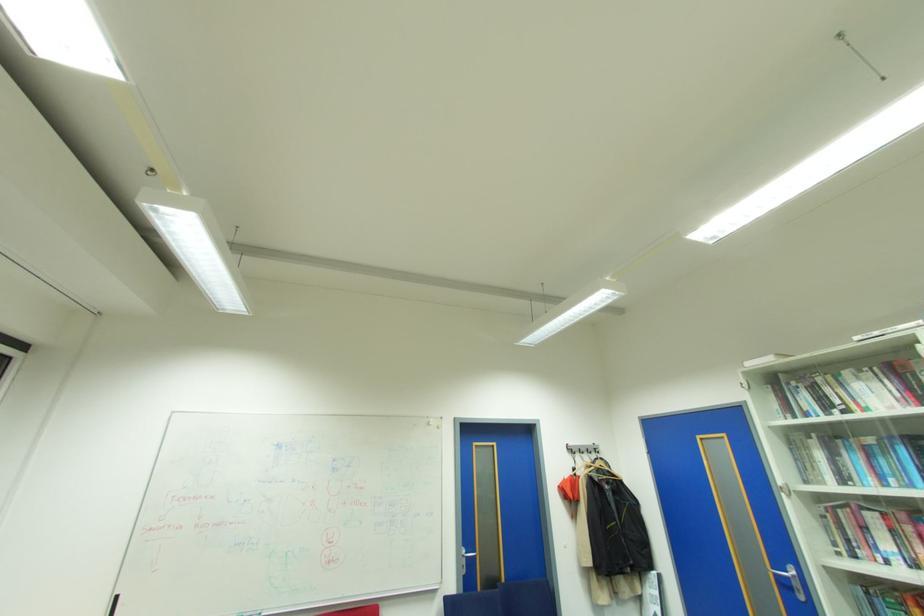
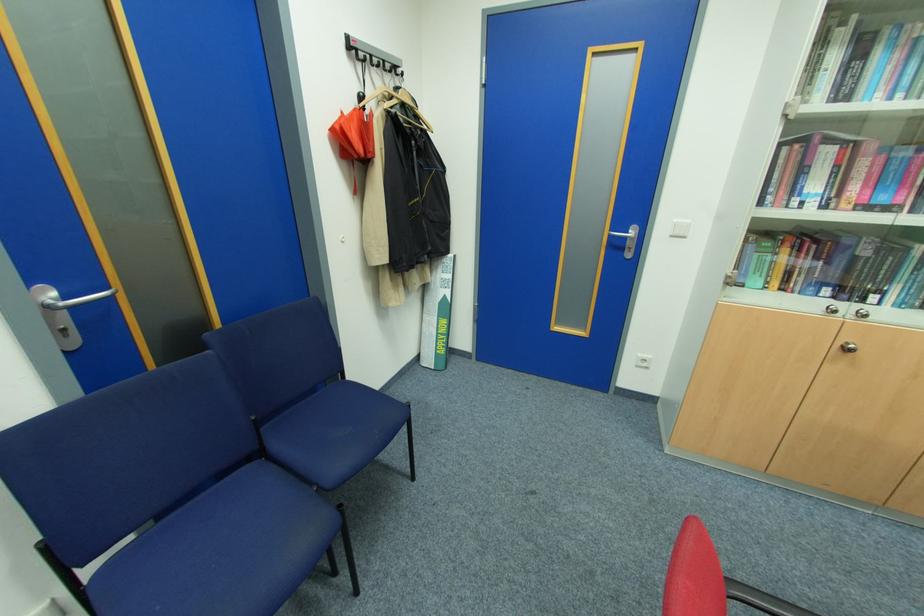
In the second image, find the point that corresponds to the point at 565,485 in the first image.

(341, 127)